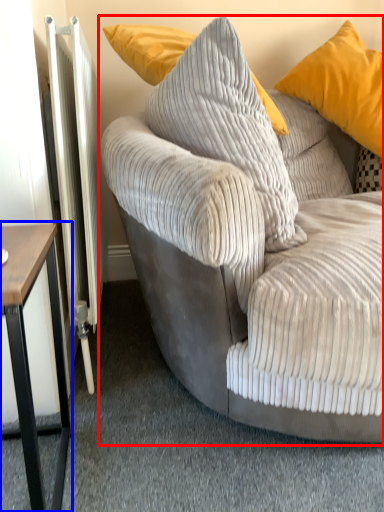
Question: Among these objects, which one is nearest to the camera, studio couch (highlighted by a red box) or table (highlighted by a blue box)?

Choices:
 (A) studio couch
 (B) table

Answer: (A)